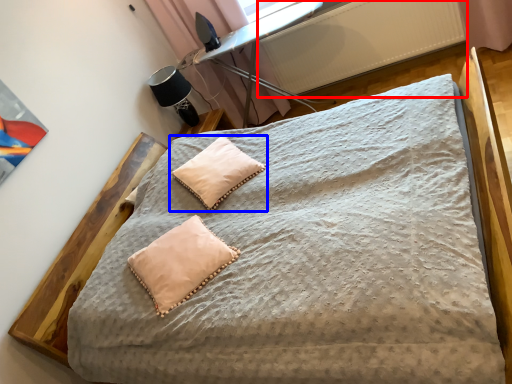
Question: Which object appears closest to the camera in this image, radiator (highlighted by a red box) or pillow (highlighted by a blue box)?

Choices:
 (A) radiator
 (B) pillow

Answer: (B)